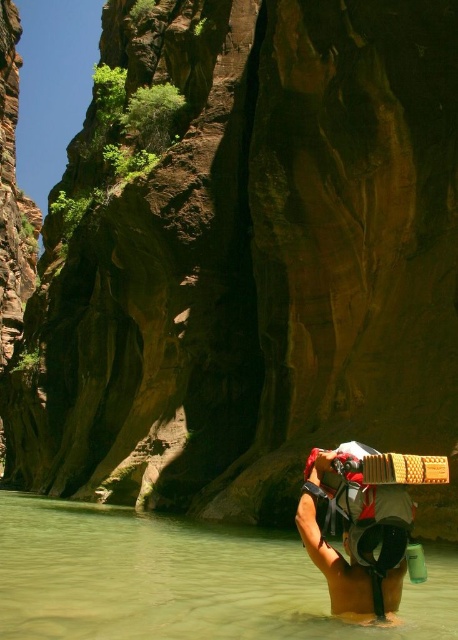
Question: Is clear water at center to the right of white fabric backpack at lower center from the viewer's perspective?

Choices:
 (A) yes
 (B) no

Answer: (B)

Question: Can you confirm if clear water at center is positioned above white fabric backpack at lower center?

Choices:
 (A) yes
 (B) no

Answer: (B)

Question: Is clear water at center behind white fabric backpack at lower center?

Choices:
 (A) yes
 (B) no

Answer: (B)

Question: Which point is closer to the camera taking this photo?

Choices:
 (A) [201, 572]
 (B) [365, 522]

Answer: (B)